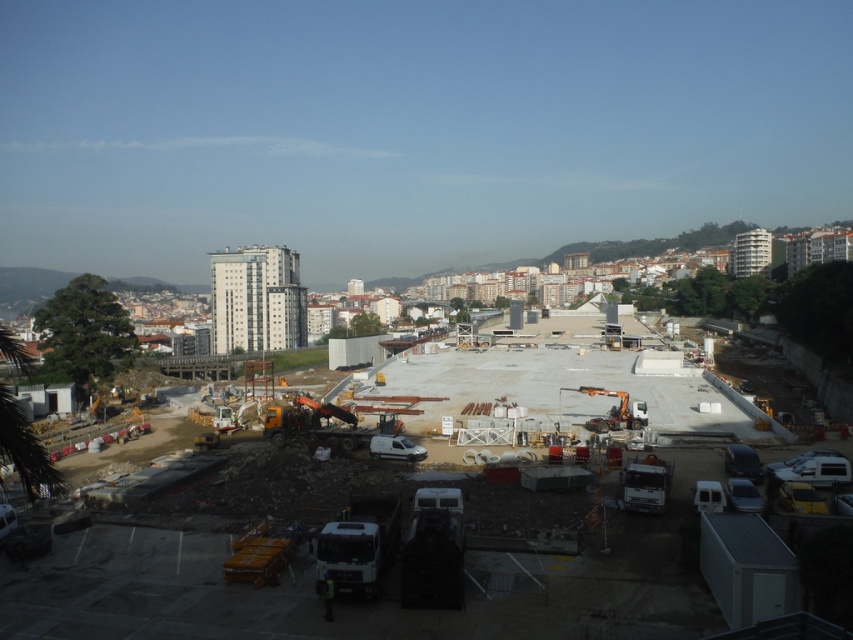
Question: Which of the following is the closest to the observer?

Choices:
 (A) white concrete construction site at center
 (B) reflective yellow safety vest at lower center
 (C) white metallic crane at center

Answer: (A)

Question: Which of these objects is positioned closest to the reflective yellow safety vest at lower center?

Choices:
 (A) white metallic crane at center
 (B) white concrete construction site at center

Answer: (B)

Question: Is white concrete construction site at center positioned behind white metallic crane at center?

Choices:
 (A) yes
 (B) no

Answer: (B)

Question: Which object is farther from the camera taking this photo?

Choices:
 (A) reflective yellow safety vest at lower center
 (B) white concrete construction site at center

Answer: (A)

Question: Is white concrete construction site at center below white metallic crane at center?

Choices:
 (A) no
 (B) yes

Answer: (B)

Question: Can you confirm if white metallic crane at center is wider than reflective yellow safety vest at lower center?

Choices:
 (A) yes
 (B) no

Answer: (A)